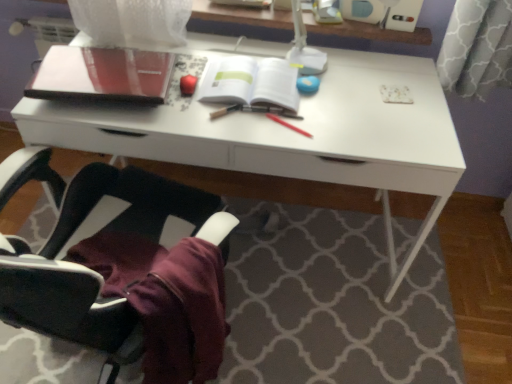
Question: Is point (208, 306) closer or farther from the camera than point (269, 117)?

Choices:
 (A) closer
 (B) farther

Answer: (A)

Question: From a real-world perspective, is black fabric chair at lower left above or below red matte pen at center, which is the first stationery from right to left?

Choices:
 (A) above
 (B) below

Answer: (B)

Question: Estimate the real-world distances between objects in this image. Which object is farther from the black fabric chair at lower left?

Choices:
 (A) glossy red apple at upper center, which ranks as the first stationery in left-to-right order
 (B) wooden pencil at center, the second stationery viewed from the right
 (C) matte black notebook at upper left
 (D) white glossy desk at center
 (E) white paper at center

Answer: (A)

Question: Considering the real-world distances, which object is farthest from the glossy red apple at upper center, which ranks as the first stationery in left-to-right order?

Choices:
 (A) matte black notebook at upper left
 (B) white paper at center
 (C) white glossy desk at center
 (D) black fabric chair at lower left
 (E) red matte pen at center, which is the first stationery from right to left

Answer: (D)